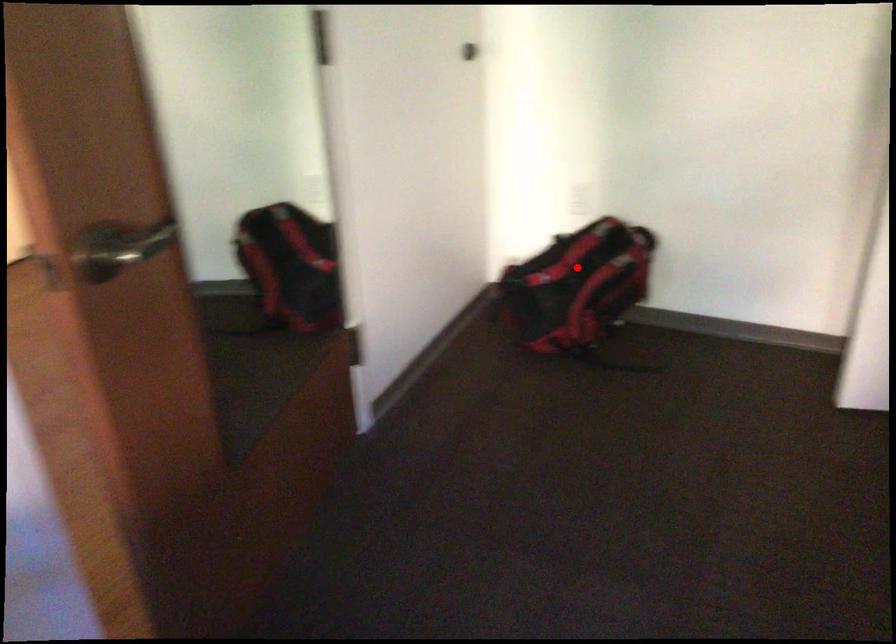
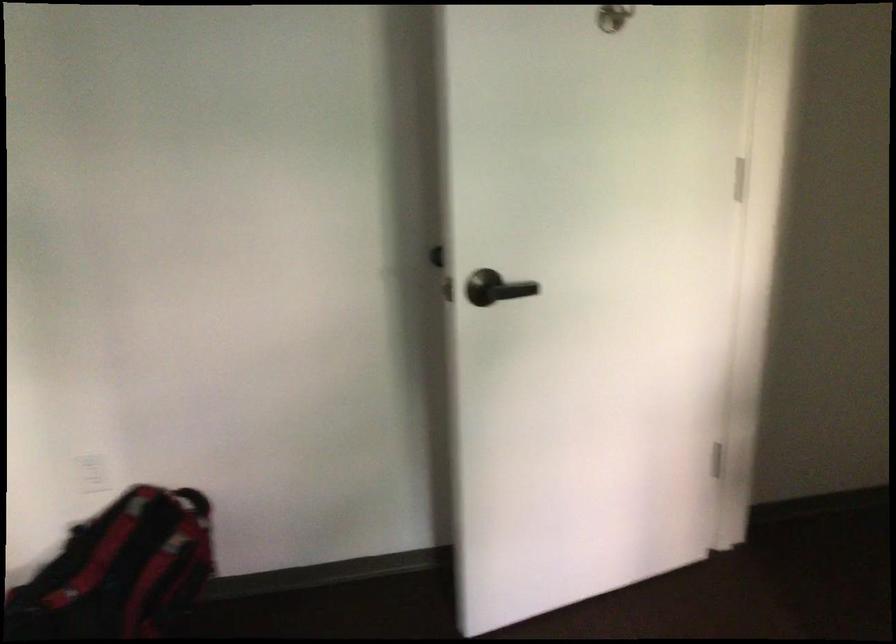
Question: I am providing you with two images of the same scene from different viewpoints. Given a red point in image1, look at the same physical point in image2. Is it:

Choices:
 (A) Closer to the viewpoint
 (B) Farther from the viewpoint

Answer: (A)